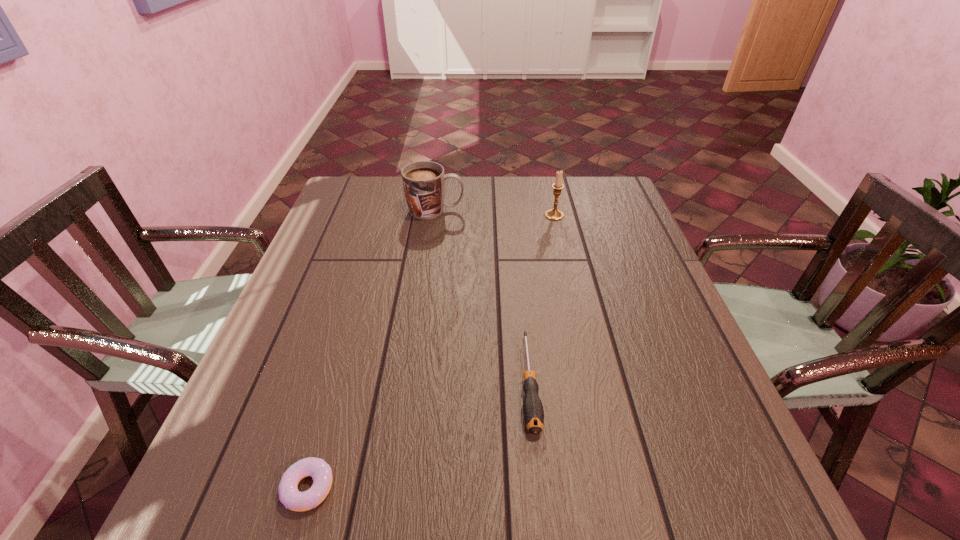
You are a GUI agent. You are given a task and a screenshot of the screen. Output one action in this format:
    pyautogui.click(x=<x>, y=<y>)
    Task: Click on the candle holder that is at the far edge
    
    Given the screenshot: What is the action you would take?
    pyautogui.click(x=553, y=214)

The height and width of the screenshot is (540, 960). Find the location of `mug located at the far edge`. mug located at the far edge is located at coordinates (424, 181).

What are the coordinates of `object that is at the near edge` in the screenshot? It's located at (321, 473).

The height and width of the screenshot is (540, 960). I want to click on object that is at the left edge, so click(x=321, y=473).

I want to click on object at the near left corner, so click(x=321, y=473).

At what (x,y) coordinates should I click in order to perform the action: click on vacant space at the far edge of the desktop. Please return your answer as a coordinate pair (x, y). This screenshot has width=960, height=540. Looking at the image, I should click on (561, 200).

At what (x,y) coordinates should I click in order to perform the action: click on vacant region at the near edge. Please return your answer as a coordinate pair (x, y). Looking at the image, I should click on (642, 527).

In the image, there is a desktop. At what (x,y) coordinates should I click in order to perform the action: click on vacant region at the left edge. Please return your answer as a coordinate pair (x, y). Looking at the image, I should click on click(x=311, y=332).

Where is `free space at the right edge`? free space at the right edge is located at coordinates (673, 467).

Where is `free space at the far left corner of the desktop`? The width and height of the screenshot is (960, 540). free space at the far left corner of the desktop is located at coordinates (376, 212).